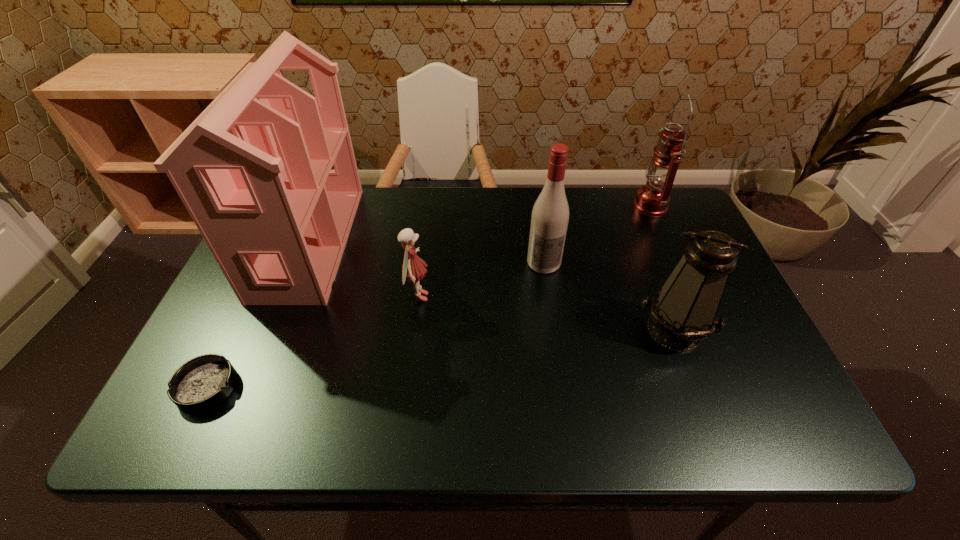
Locate an element on the screen. the tallest object is located at coordinates (253, 170).

Locate an element on the screen. the farther oil lamp is located at coordinates (652, 200).

Locate an element on the screen. the third object from right to left is located at coordinates (550, 215).

Identify the location of the fourth tallest object. (684, 311).

Find the location of a particular element. The height and width of the screenshot is (540, 960). the nearer oil lamp is located at coordinates (684, 311).

At what (x,y) coordinates should I click in order to perform the action: click on doll. Please return your answer as a coordinate pair (x, y). This screenshot has width=960, height=540. Looking at the image, I should click on coord(413,269).

Find the location of a particular element. the fourth object from right to left is located at coordinates (413, 269).

The height and width of the screenshot is (540, 960). Find the location of `the nearest object`. the nearest object is located at coordinates (202, 383).

Image resolution: width=960 pixels, height=540 pixels. I want to click on ashtray, so click(202, 383).

Locate an element on the screen. The width and height of the screenshot is (960, 540). blank space located on the front-facing side of the dollhouse is located at coordinates (x=484, y=241).